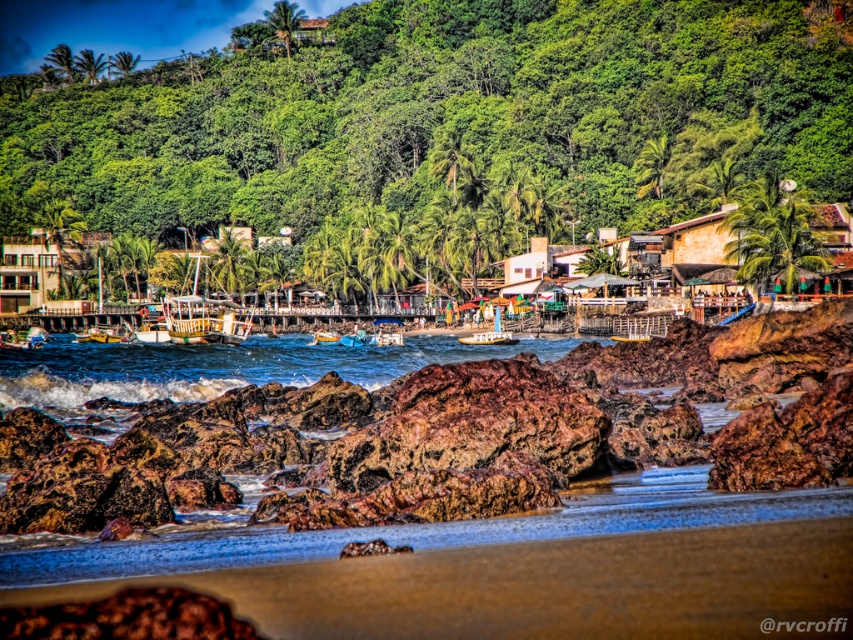
Question: Which of the following is the farthest from the observer?

Choices:
 (A) (468, 337)
 (B) (386, 324)

Answer: (B)

Question: Estimate the real-world distances between objects in this image. Which object is closer to the bright orange plastic boat at center?

Choices:
 (A) bright blue plastic boat at center
 (B) metallic silver boat at lower left
 (C) green leafy hillside at upper center
 (D) metallic blue boat at center

Answer: (A)

Question: Is green leafy hillside at upper center positioned behind metallic silver boat at lower left?

Choices:
 (A) no
 (B) yes

Answer: (B)

Question: Can you confirm if bright yellow plastic boat at center is positioned below bright blue plastic boat at center?

Choices:
 (A) yes
 (B) no

Answer: (B)

Question: Does green leafy hillside at upper center appear under bright yellow plastic boat at center?

Choices:
 (A) yes
 (B) no

Answer: (B)

Question: Which of these objects is positioned farthest from the bright blue plastic boat at center?

Choices:
 (A) blue water at center
 (B) bright orange plastic boat at center

Answer: (A)